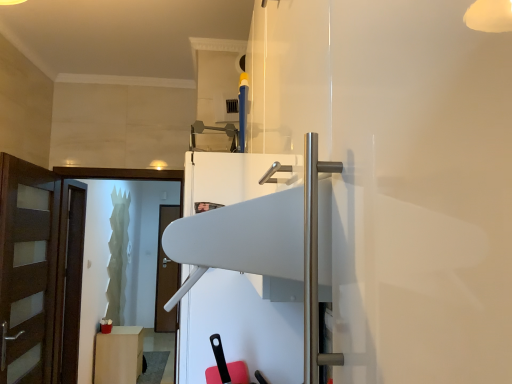
The width and height of the screenshot is (512, 384). I want to click on vacant area on top of transparent glass screen door at left (from a real-world perspective), so click(122, 161).